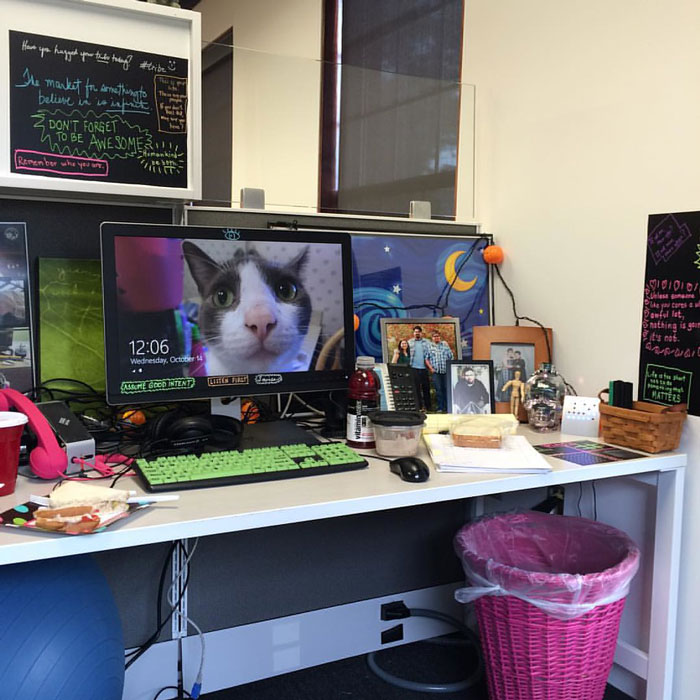
Locate an element on the screen. The width and height of the screenshot is (700, 700). keybaord is located at coordinates (245, 456).